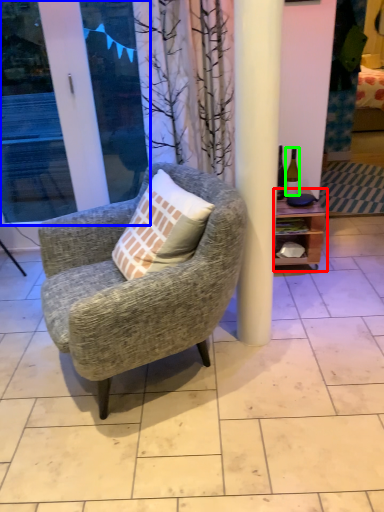
Question: Which object is positioned closest to shelf (highlighted by a red box)? Select from screen door (highlighted by a blue box) and bottle (highlighted by a green box).

Choices:
 (A) screen door
 (B) bottle

Answer: (B)